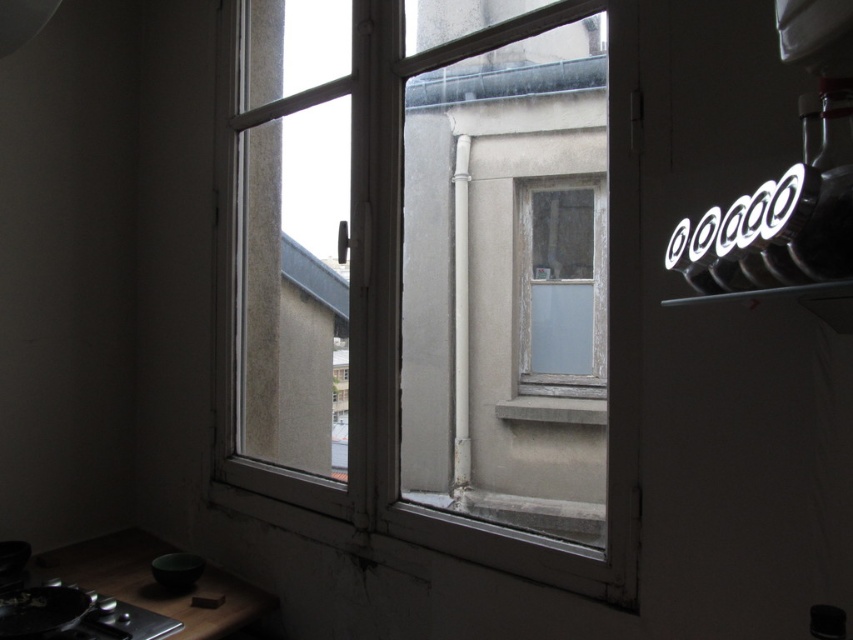
Can you confirm if white glossy neon sign at upper right is positioned to the left of white frosted glass window at center?

Incorrect, white glossy neon sign at upper right is not on the left side of white frosted glass window at center.

Locate an element on the screen. The width and height of the screenshot is (853, 640). white glossy neon sign at upper right is located at coordinates (781, 214).

Is white matte window at center taller than white frosted glass window at center?

Correct, white matte window at center is much taller as white frosted glass window at center.

Can you confirm if white matte window at center is thinner than white frosted glass window at center?

Incorrect, white matte window at center's width is not less than white frosted glass window at center's.

Between point (518, 144) and point (558, 320), which one is positioned behind?

Positioned behind is point (518, 144).

Locate an element on the screen. white matte window at center is located at coordinates (433, 273).

Is point (328, 340) positioned before point (532, 413)?

No.

Looking at this image, which is more to the right, white matte window at center or gray concrete window sill at center?

Positioned to the right is gray concrete window sill at center.

Does point (485, 465) lie behind point (502, 410)?

Yes.

This screenshot has width=853, height=640. I want to click on white matte window at center, so point(433,273).